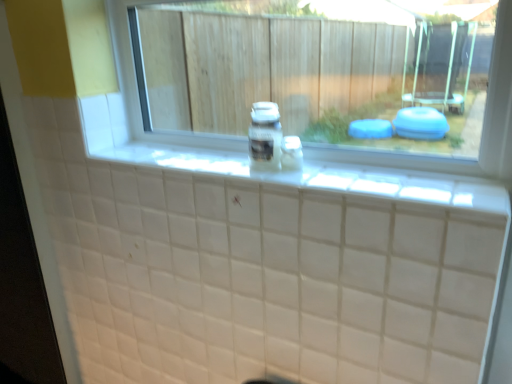
Question: Is white tile ledge at center positioned in front of transparent glass window at center?

Choices:
 (A) yes
 (B) no

Answer: (A)

Question: Does white tile ledge at center appear on the left side of transparent glass window at center?

Choices:
 (A) yes
 (B) no

Answer: (A)

Question: Is white tile ledge at center positioned beyond the bounds of transparent glass window at center?

Choices:
 (A) yes
 (B) no

Answer: (A)

Question: From the image's perspective, is white tile ledge at center located beneath transparent glass window at center?

Choices:
 (A) yes
 (B) no

Answer: (A)

Question: From a real-world perspective, is white tile ledge at center below transparent glass window at center?

Choices:
 (A) yes
 (B) no

Answer: (A)

Question: Can you confirm if white tile ledge at center is wider than transparent glass window at center?

Choices:
 (A) yes
 (B) no

Answer: (A)

Question: From a real-world perspective, is white tile ledge at center located higher than clear plastic bottle at center?

Choices:
 (A) yes
 (B) no

Answer: (B)

Question: Is white tile ledge at center oriented away from clear plastic bottle at center?

Choices:
 (A) no
 (B) yes

Answer: (B)

Question: Is white tile ledge at center thinner than clear plastic bottle at center?

Choices:
 (A) yes
 (B) no

Answer: (B)

Question: From the image's perspective, would you say white tile ledge at center is positioned over clear plastic bottle at center?

Choices:
 (A) yes
 (B) no

Answer: (B)

Question: Considering the relative sizes of white tile ledge at center and clear plastic bottle at center in the image provided, is white tile ledge at center taller than clear plastic bottle at center?

Choices:
 (A) yes
 (B) no

Answer: (B)

Question: Are white tile ledge at center and clear plastic bottle at center making contact?

Choices:
 (A) no
 (B) yes

Answer: (A)

Question: From a real-world perspective, does clear plastic bottle at center sit lower than white tile ledge at center?

Choices:
 (A) yes
 (B) no

Answer: (B)